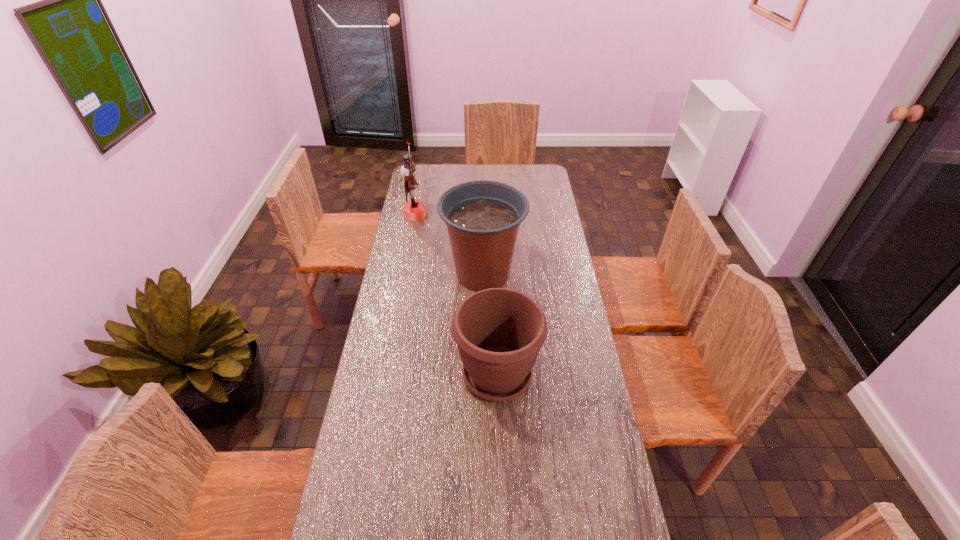
I want to click on vacant space at the left edge of the desktop, so click(401, 241).

At what (x,y) coordinates should I click in order to perform the action: click on vacant space at the right edge of the desktop. Please return your answer as a coordinate pair (x, y). Image resolution: width=960 pixels, height=540 pixels. Looking at the image, I should click on (547, 207).

Find the location of a particular element. The width and height of the screenshot is (960, 540). vacant space at the far right corner is located at coordinates (526, 179).

Image resolution: width=960 pixels, height=540 pixels. In order to click on vacant point located between the shorter flowerpot and the leftmost object in this screenshot , I will do `click(456, 294)`.

You are a GUI agent. You are given a task and a screenshot of the screen. Output one action in this format:
    pyautogui.click(x=<x>, y=<y>)
    Task: Click on the empty space between the nutcracker and the shortest object
    This screenshot has width=960, height=540.
    Given the screenshot: What is the action you would take?
    pyautogui.click(x=456, y=294)

Where is `vacant area that lies between the leftmost object and the nearer flowerpot`? vacant area that lies between the leftmost object and the nearer flowerpot is located at coordinates (456, 294).

Find the location of a particular element. The image size is (960, 540). free point between the farthest object and the nearer flowerpot is located at coordinates point(456,294).

The image size is (960, 540). I want to click on object that stands as the second closest to the nearer flowerpot, so click(x=414, y=210).

Select which object appears as the closest to the nearer flowerpot. Please provide its 2D coordinates. Your answer should be formatted as a tuple, i.e. [(x, y)], where the tuple contains the x and y coordinates of a point satisfying the conditions above.

[(483, 217)]

Image resolution: width=960 pixels, height=540 pixels. I want to click on free location that satisfies the following two spatial constraints: 1. on the back side of the shorter flowerpot; 2. on the front-facing side of the leftmost object, so click(x=492, y=214).